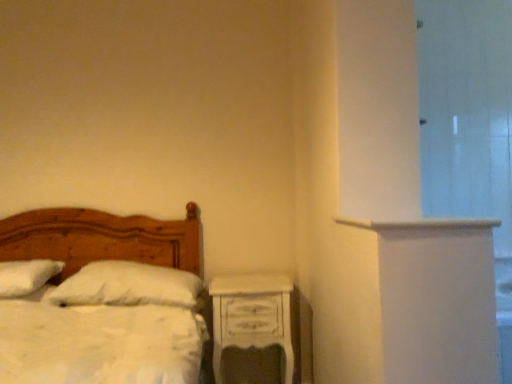
Locate an element on the screen. The image size is (512, 384). transparent glass door at right is located at coordinates (468, 119).

The height and width of the screenshot is (384, 512). What do you see at coordinates (102, 238) in the screenshot? I see `wooden bed at left` at bounding box center [102, 238].

Image resolution: width=512 pixels, height=384 pixels. Describe the element at coordinates (26, 276) in the screenshot. I see `white fluffy pillow at left, which ranks as the 2th pillow in right-to-left order` at that location.

What is the approximate width of white painted wood ledge at upper right?

white painted wood ledge at upper right is 52.38 centimeters wide.

Image resolution: width=512 pixels, height=384 pixels. What do you see at coordinates (128, 286) in the screenshot? I see `white soft pillow at center, arranged as the 1th pillow when viewed from the right` at bounding box center [128, 286].

Image resolution: width=512 pixels, height=384 pixels. Find the location of `white soft pillow at center, arranged as the 1th pillow when viewed from the right`. white soft pillow at center, arranged as the 1th pillow when viewed from the right is located at coordinates pos(128,286).

You are a GUI agent. You are given a task and a screenshot of the screen. Output one action in this format:
    pyautogui.click(x=<x>, y=<y>)
    Task: Click on the transparent glass door at right
    The width and height of the screenshot is (512, 384).
    Given the screenshot: What is the action you would take?
    pyautogui.click(x=468, y=119)

Is the surface of transparent glass door at right in direct contact with white soft pillow at center, arranged as the 1th pillow when viewed from the right?

No, transparent glass door at right is not in contact with white soft pillow at center, arranged as the 1th pillow when viewed from the right.

From a real-world perspective, is transparent glass door at right beneath white soft pillow at center, which ranks as the 2th pillow in left-to-right order?

No.

From the image's perspective, does transparent glass door at right appear lower than white soft pillow at center, which ranks as the 2th pillow in left-to-right order?

No.

Is transparent glass door at right located outside white soft pillow at center, which ranks as the 2th pillow in left-to-right order?

That's correct, transparent glass door at right is outside of white soft pillow at center, which ranks as the 2th pillow in left-to-right order.

Could you measure the distance between white soft pillow at center, arranged as the 1th pillow when viewed from the right, and white fluffy pillow at left, which ranks as the 2th pillow in right-to-left order?

They are 39.33 centimeters apart.

In terms of size, does white soft pillow at center, which ranks as the 2th pillow in left-to-right order, appear bigger or smaller than white fluffy pillow at left, which ranks as the 2th pillow in right-to-left order?

Considering their sizes, white soft pillow at center, which ranks as the 2th pillow in left-to-right order, takes up more space than white fluffy pillow at left, which ranks as the 2th pillow in right-to-left order.

Can you confirm if white soft pillow at center, which ranks as the 2th pillow in left-to-right order, is thinner than white fluffy pillow at left, which ranks as the 2th pillow in right-to-left order?

Correct, the width of white soft pillow at center, which ranks as the 2th pillow in left-to-right order, is less than that of white fluffy pillow at left, which ranks as the 2th pillow in right-to-left order.

The height and width of the screenshot is (384, 512). I want to click on pillow behind the white fluffy pillow at left, marked as the 1th pillow in a left-to-right arrangement, so click(128, 286).

What's the angular difference between white soft pillow at center, which ranks as the 2th pillow in left-to-right order, and white painted wood ledge at upper right's facing directions?

The angle between the facing direction of white soft pillow at center, which ranks as the 2th pillow in left-to-right order, and the facing direction of white painted wood ledge at upper right is 1.89 degrees.

Is white soft pillow at center, arranged as the 1th pillow when viewed from the right, shorter than white painted wood ledge at upper right?

No.

From a real-world perspective, which object stands above the other?

white painted wood ledge at upper right, from a real-world perspective.

Can we say white soft pillow at center, arranged as the 1th pillow when viewed from the right, lies outside white painted wood ledge at upper right?

Absolutely, white soft pillow at center, arranged as the 1th pillow when viewed from the right, is external to white painted wood ledge at upper right.

Does point (188, 301) come farther from viewer compared to point (118, 256)?

No, (188, 301) is in front of (118, 256).

The height and width of the screenshot is (384, 512). I want to click on pillow on the right of wooden bed at left, so [x=128, y=286].

Can you confirm if white soft pillow at center, which ranks as the 2th pillow in left-to-right order, is taller than wooden bed at left?

In fact, white soft pillow at center, which ranks as the 2th pillow in left-to-right order, may be shorter than wooden bed at left.

Is white soft pillow at center, arranged as the 1th pillow when viewed from the right, oriented away from wooden bed at left?

Yes, white soft pillow at center, arranged as the 1th pillow when viewed from the right, is facing away from wooden bed at left.

Is wooden bed at left turned away from transparent glass door at right?

No, wooden bed at left is not facing the opposite direction of transparent glass door at right.

Which is correct: wooden bed at left is inside transparent glass door at right, or outside of it?

wooden bed at left is not enclosed by transparent glass door at right.

From the picture: From the image's perspective, is wooden bed at left positioned above or below transparent glass door at right?

From the image's perspective, wooden bed at left appears below transparent glass door at right.

Looking at their sizes, would you say white painted wood ledge at upper right is wider or thinner than white fluffy pillow at left, which ranks as the 2th pillow in right-to-left order?

In the image, white painted wood ledge at upper right appears to be wider than white fluffy pillow at left, which ranks as the 2th pillow in right-to-left order.

Who is taller, white painted wood ledge at upper right or white fluffy pillow at left, which ranks as the 2th pillow in right-to-left order?

white fluffy pillow at left, which ranks as the 2th pillow in right-to-left order.

Consider the image. How many degrees apart are the facing directions of white painted wood ledge at upper right and white fluffy pillow at left, which ranks as the 2th pillow in right-to-left order?

The angular difference between white painted wood ledge at upper right and white fluffy pillow at left, which ranks as the 2th pillow in right-to-left order, is 0.074 degrees.

Consider the image. Considering the positions of objects transparent glass door at right and white fluffy pillow at left, marked as the 1th pillow in a left-to-right arrangement, in the image provided, who is more to the left, transparent glass door at right or white fluffy pillow at left, marked as the 1th pillow in a left-to-right arrangement,?

white fluffy pillow at left, marked as the 1th pillow in a left-to-right arrangement.

Would you say transparent glass door at right is inside or outside white fluffy pillow at left, marked as the 1th pillow in a left-to-right arrangement?

transparent glass door at right is not inside white fluffy pillow at left, marked as the 1th pillow in a left-to-right arrangement, it's outside.

From the image's perspective, which is below, transparent glass door at right or white fluffy pillow at left, which ranks as the 2th pillow in right-to-left order?

white fluffy pillow at left, which ranks as the 2th pillow in right-to-left order, is shown below in the image.

From the transparent glass door at right, count 2nd pillows backward and point to it. Please provide its 2D coordinates.

[(128, 286)]

Identify the location of pillow on the right of the white fluffy pillow at left, marked as the 1th pillow in a left-to-right arrangement. (128, 286).

When comparing their distances from white painted wood nightstand at lower right, does transparent glass door at right or wooden bed at left seem further?

transparent glass door at right is further to white painted wood nightstand at lower right.

Which object lies further to the anchor point white soft pillow at center, which ranks as the 2th pillow in left-to-right order, white fluffy pillow at left, which ranks as the 2th pillow in right-to-left order, or white painted wood nightstand at lower right?

white fluffy pillow at left, which ranks as the 2th pillow in right-to-left order, lies further to white soft pillow at center, which ranks as the 2th pillow in left-to-right order, than the other object.

Considering their positions, is white painted wood ledge at upper right positioned closer to white painted wood nightstand at lower right than white fluffy pillow at left, marked as the 1th pillow in a left-to-right arrangement?

white painted wood ledge at upper right lies closer to white painted wood nightstand at lower right than the other object.

Considering their positions, is white painted wood ledge at upper right positioned closer to white soft pillow at center, arranged as the 1th pillow when viewed from the right, than wooden bed at left?

wooden bed at left lies closer to white soft pillow at center, arranged as the 1th pillow when viewed from the right, than the other object.

Based on their spatial positions, is transparent glass door at right or wooden bed at left further from white soft pillow at center, arranged as the 1th pillow when viewed from the right?

The object further to white soft pillow at center, arranged as the 1th pillow when viewed from the right, is transparent glass door at right.

From the picture: Which object lies further to the anchor point wooden bed at left, white painted wood nightstand at lower right or white painted wood ledge at upper right?

white painted wood ledge at upper right is positioned further to the anchor wooden bed at left.

Looking at the image, which one is located closer to white soft pillow at center, arranged as the 1th pillow when viewed from the right, wooden bed at left or white painted wood ledge at upper right?

Among the two, wooden bed at left is located nearer to white soft pillow at center, arranged as the 1th pillow when viewed from the right.

Which object lies further to the anchor point white painted wood nightstand at lower right, white soft pillow at center, arranged as the 1th pillow when viewed from the right, or transparent glass door at right?

transparent glass door at right is further to white painted wood nightstand at lower right.

You are a GUI agent. You are given a task and a screenshot of the screen. Output one action in this format:
    pyautogui.click(x=<x>, y=<y>)
    Task: Click on the pillow between white fluffy pillow at left, marked as the 1th pillow in a left-to-right arrangement, and white painted wood nightstand at lower right
    The image size is (512, 384).
    Given the screenshot: What is the action you would take?
    pyautogui.click(x=128, y=286)

Identify the location of pillow between white fluffy pillow at left, marked as the 1th pillow in a left-to-right arrangement, and white painted wood ledge at upper right, in the horizontal direction. This screenshot has height=384, width=512. (128, 286).

This screenshot has width=512, height=384. In order to click on ledge positioned between wooden bed at left and white painted wood nightstand at lower right from near to far in this screenshot , I will do `click(420, 223)`.

I want to click on ledge between white fluffy pillow at left, which ranks as the 2th pillow in right-to-left order, and transparent glass door at right, in the horizontal direction, so click(x=420, y=223).